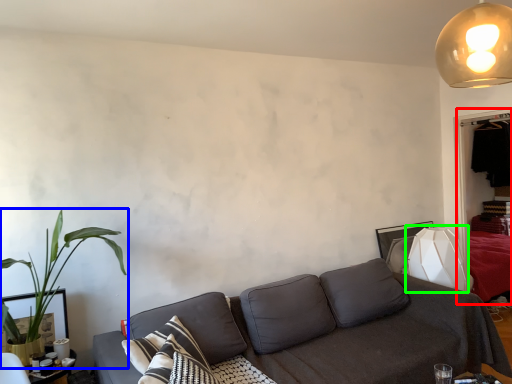
Question: Which object is positioned closest to dresser (highlighted by a red box)? Select from houseplant (highlighted by a blue box) and table lamp (highlighted by a green box).

Choices:
 (A) houseplant
 (B) table lamp

Answer: (B)